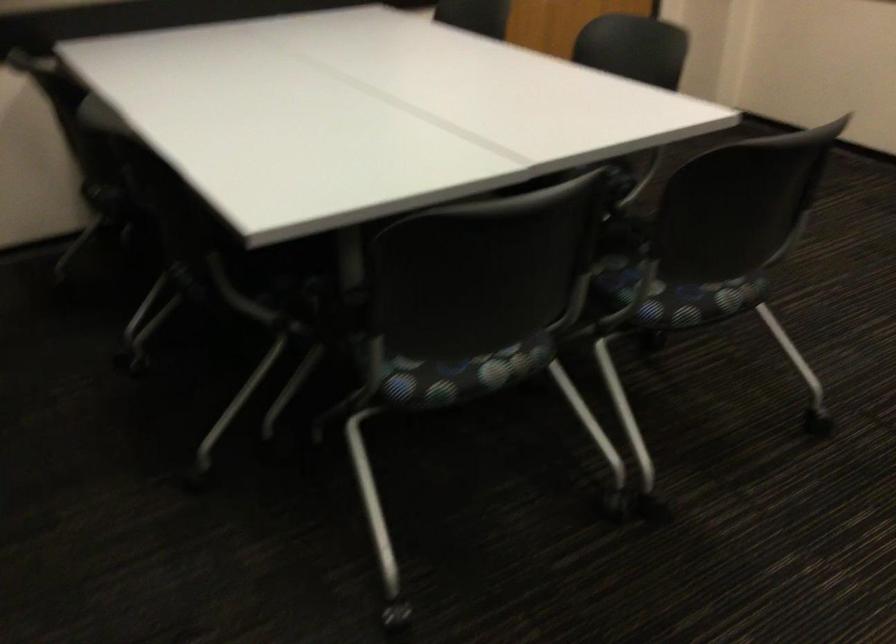
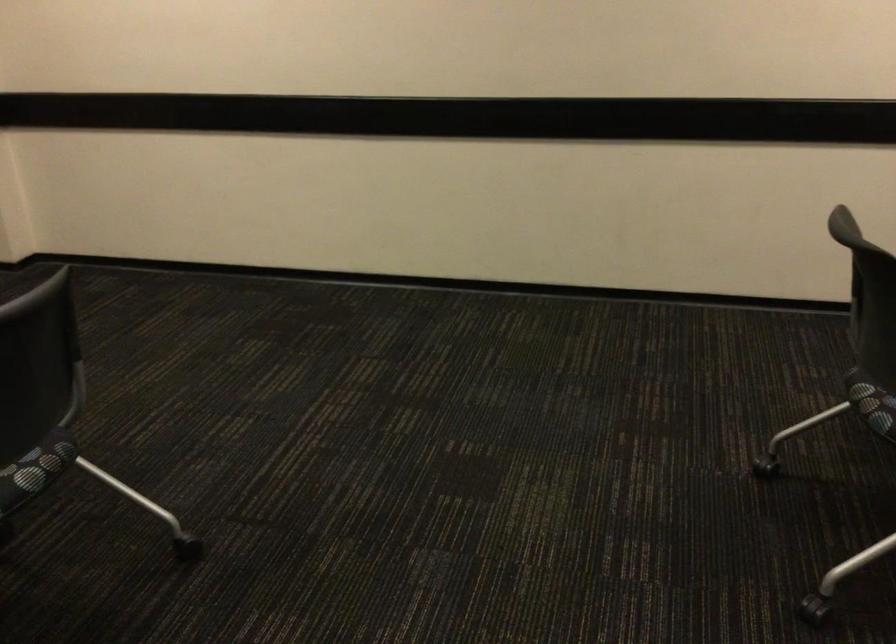
The point at (739, 295) is marked in the first image. Where is the corresponding point in the second image?

(40, 462)